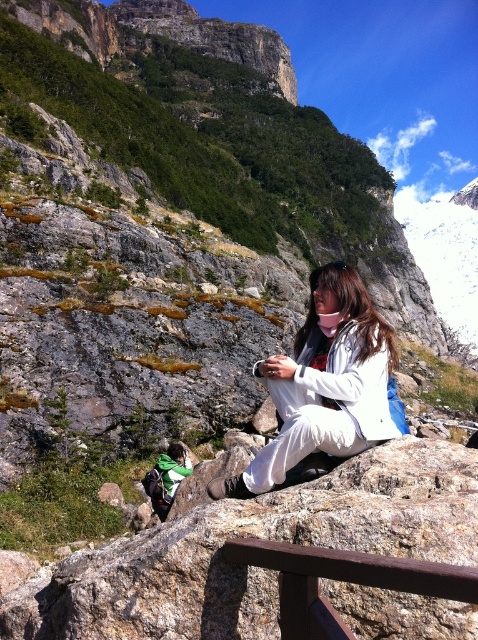
Can you confirm if white matte jacket at center is smaller than brown wood rail at lower center?

Incorrect, white matte jacket at center is not smaller in size than brown wood rail at lower center.

Does white matte jacket at center have a larger size compared to brown wood rail at lower center?

Yes.

Describe the element at coordinates (325, 384) in the screenshot. The image size is (478, 640). I see `white matte jacket at center` at that location.

What are the coordinates of `white matte jacket at center` in the screenshot? It's located at (325, 384).